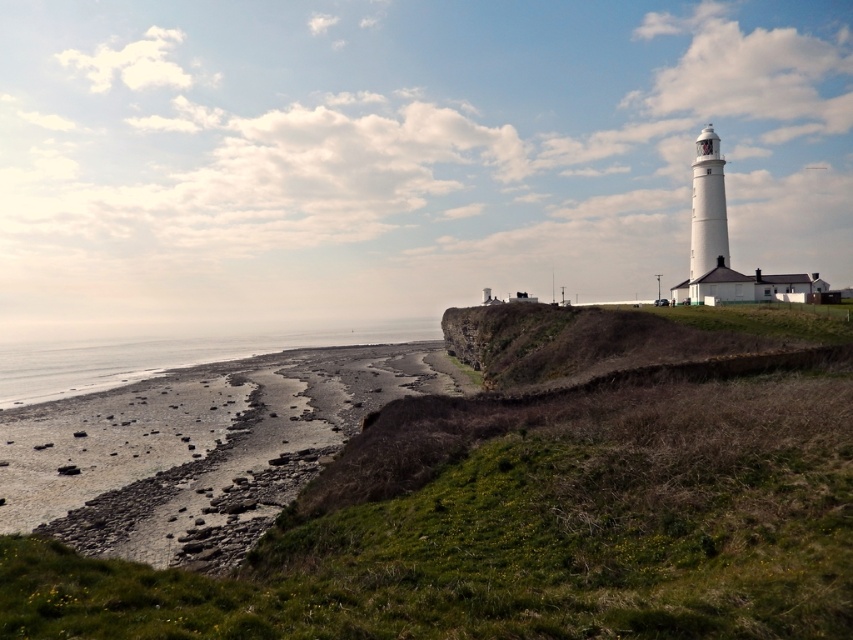
Is smooth pebbles at lower left bigger than gray sand at lower left?

No, smooth pebbles at lower left is not bigger than gray sand at lower left.

Who is positioned more to the right, smooth pebbles at lower left or gray sand at lower left?

smooth pebbles at lower left

Who is more distant from viewer, (103, 554) or (154, 371)?

Point (154, 371)

The image size is (853, 640). What are the coordinates of `smooth pebbles at lower left` in the screenshot? It's located at (198, 449).